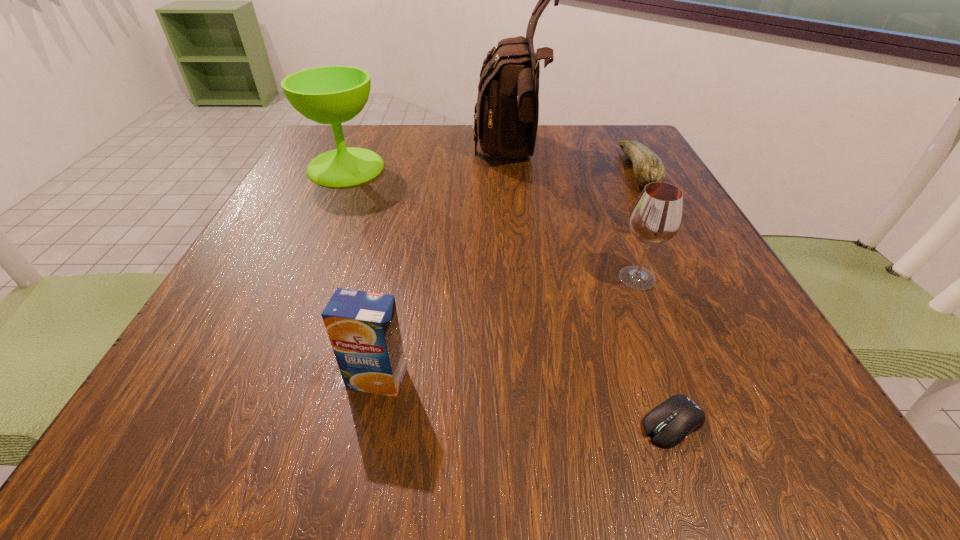
Find the location of a particular element. This screenshot has width=960, height=540. vacant point located between the shoulder bag and the farther wineglass is located at coordinates (429, 162).

Identify the location of free spot between the nearer wineglass and the second nearest object. The width and height of the screenshot is (960, 540). (507, 329).

Locate an element on the screen. free spot between the shortest object and the taller wineglass is located at coordinates (510, 295).

Locate an element on the screen. This screenshot has width=960, height=540. free point between the shortest object and the fifth tallest object is located at coordinates (656, 296).

Find the location of `free space between the rightmost object and the shoulder bag`. free space between the rightmost object and the shoulder bag is located at coordinates (575, 164).

Where is `vacant space in between the third object from left to right and the shortest object`? This screenshot has height=540, width=960. vacant space in between the third object from left to right and the shortest object is located at coordinates (592, 290).

The image size is (960, 540). In order to click on free space between the shortest object and the fourth farthest object in this screenshot , I will do `click(655, 350)`.

Image resolution: width=960 pixels, height=540 pixels. In order to click on free space between the right wineglass and the second nearest object in this screenshot , I will do `click(507, 329)`.

What are the coordinates of `free space between the third nearest object and the computer equipment` in the screenshot? It's located at (655, 350).

In order to click on object that is the fifth closest to the right wineglass in this screenshot , I will do `click(333, 95)`.